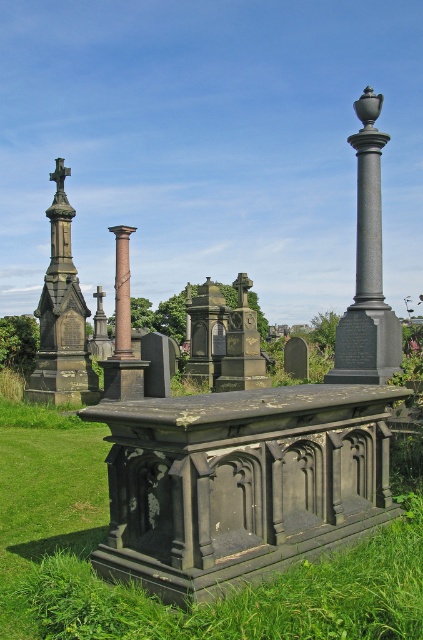
From the picture: Does smooth gray column at center lie behind dark gray stone cross at left?

No, smooth gray column at center is in front of dark gray stone cross at left.

Does smooth gray column at center have a lesser width compared to dark gray stone cross at left?

Incorrect, smooth gray column at center's width is not less than dark gray stone cross at left's.

Is point (362, 310) positioned before point (66, 308)?

Yes, point (362, 310) is in front of point (66, 308).

Where is `smooth gray column at center`? The width and height of the screenshot is (423, 640). smooth gray column at center is located at coordinates (368, 269).

Based on the photo, does smooth gray column at center appear over brown marble column at center?

Yes.

Describe the element at coordinates (368, 269) in the screenshot. I see `smooth gray column at center` at that location.

Where is `smooth gray column at center`? The image size is (423, 640). smooth gray column at center is located at coordinates (x=368, y=269).

Is point (60, 193) less distant than point (107, 397)?

No, (60, 193) is further to viewer.

Who is more distant from viewer, (57, 332) or (118, 321)?

Positioned behind is point (57, 332).

The image size is (423, 640). In order to click on dark gray stone cross at left in this screenshot , I will do `click(62, 316)`.